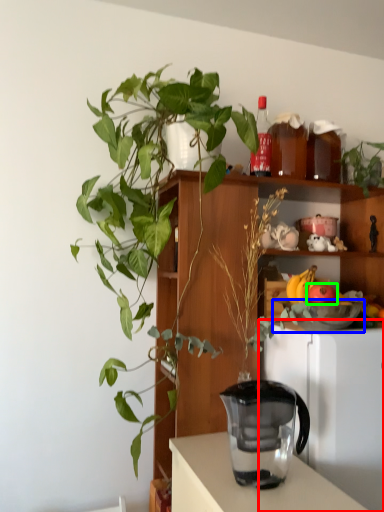
Question: Considering the real-world distances, which object is closest to appliance (highlighted by a red box)? bowl (highlighted by a blue box) or apple (highlighted by a green box).

Choices:
 (A) bowl
 (B) apple

Answer: (A)